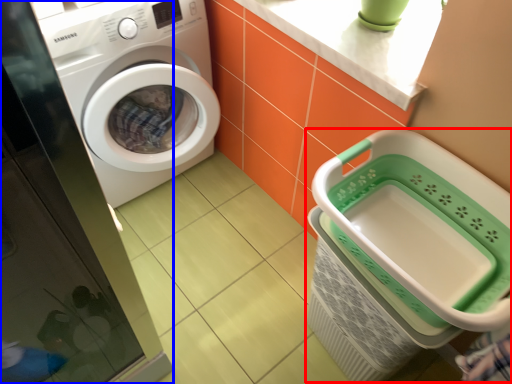
Question: Which object appears farthest to the camera in this image, shopping basket (highlighted by a red box) or screen door (highlighted by a blue box)?

Choices:
 (A) shopping basket
 (B) screen door

Answer: (A)